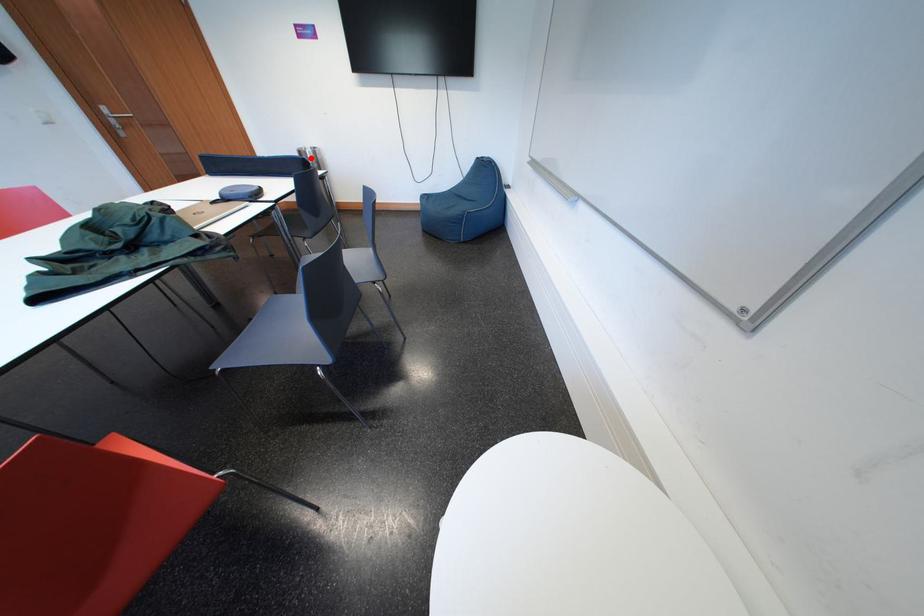
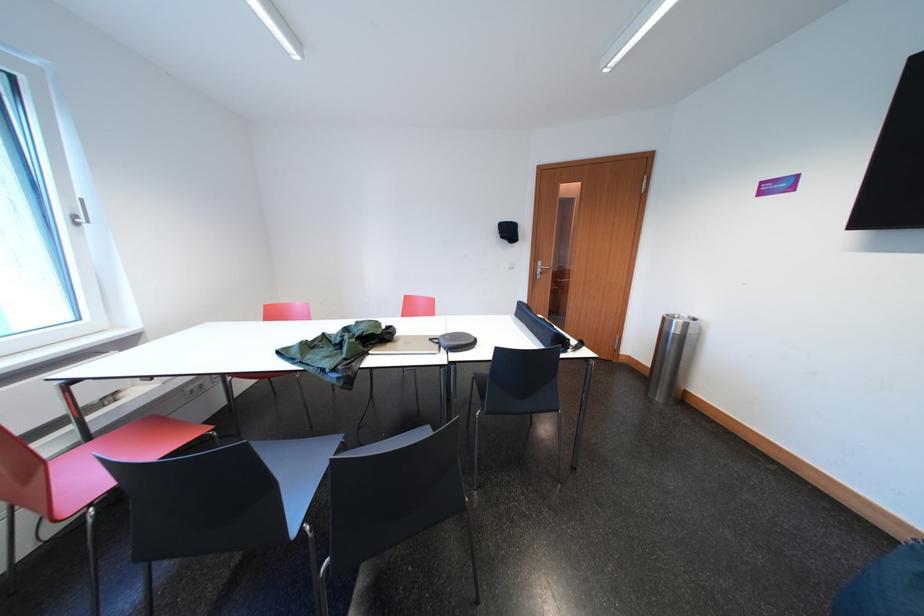
Where in the second image is the point corresponding to the highlighted location from the first image?

(675, 325)